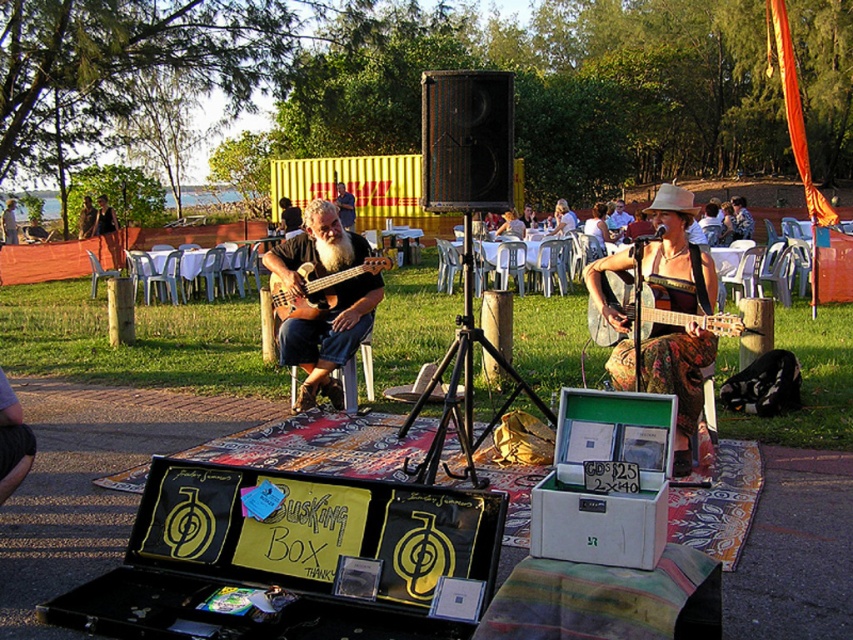
You are standing in the outdoor musical performance area and want to place a small stool between the two points labeled as point (352, 298) and point (590, 336). Which point should the stool be closer to in order to be closer to the viewer?

The stool should be closer to point (352, 298) because it is closer to the viewer than point (590, 336).

You are a photographer trying to capture the musicians and their guitars. You want to ensure both the floral fabric guitar at center and the matte brown guitar at center are visible in your shot. Which guitar should you focus on first to frame the photo properly?

The floral fabric guitar at center is located below the matte brown guitar at center, so you should focus on the matte brown guitar at center first to ensure both are in frame.